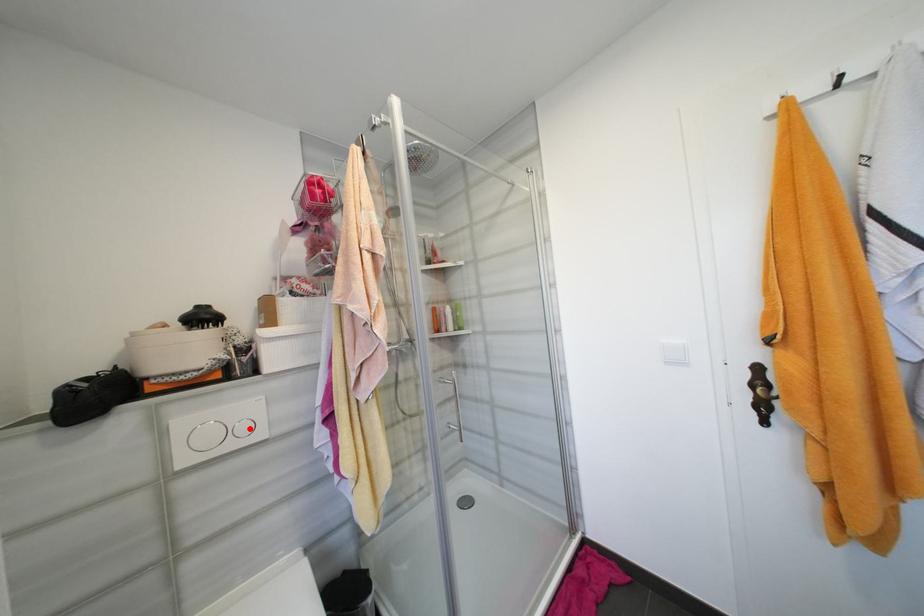
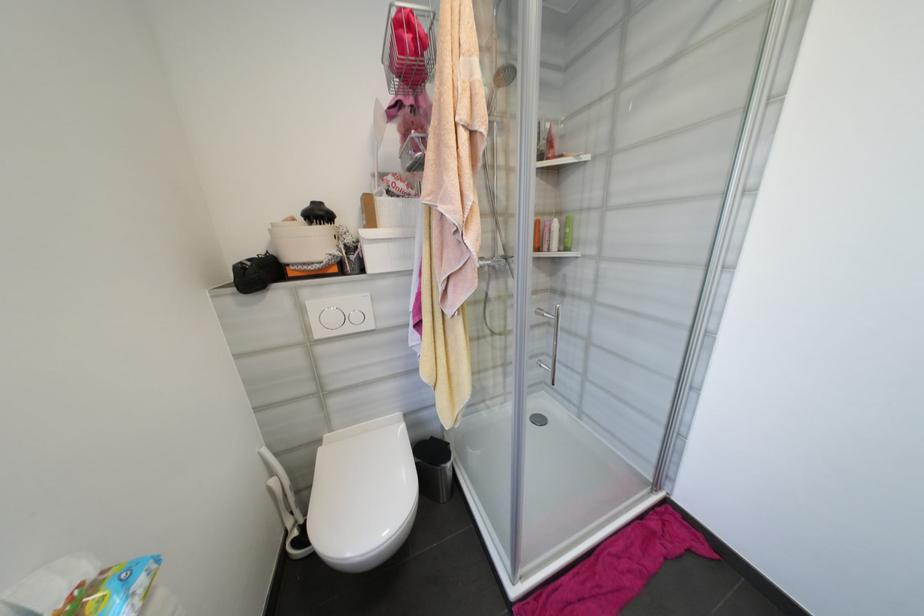
The point at the highlighted location is marked in the first image. Where is the corresponding point in the second image?

(361, 318)